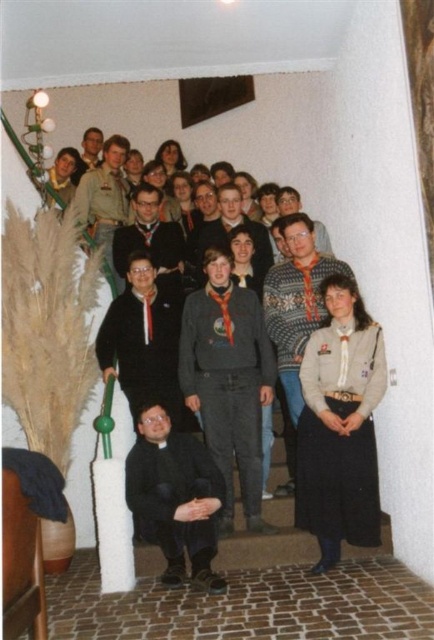
You are a photographer trying to capture a clear photo of the black sweater at center and the knitted sweater at center. Which one is located lower in the image?

The black sweater at center is positioned under the knitted sweater at center, so it is located lower in the image.

You are standing at the bottom of the staircase and want to reach the point marked as point (280, 348). However, there is an obstacle at point (154, 320). Will you encounter the obstacle before reaching your destination?

Yes, you will encounter the obstacle at point (154, 320) before reaching point (280, 348) because point (154, 320) is closer to the camera than point (280, 348).